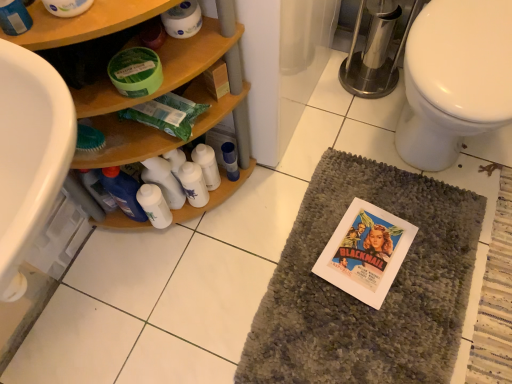
You are a GUI agent. You are given a task and a screenshot of the screen. Output one action in this format:
    pyautogui.click(x=<x>, y=<y>)
    Task: Click on the vacant area in front of blue glossy bottle at center, the first bottle positioned from the right
    
    Given the screenshot: What is the action you would take?
    pyautogui.click(x=238, y=225)